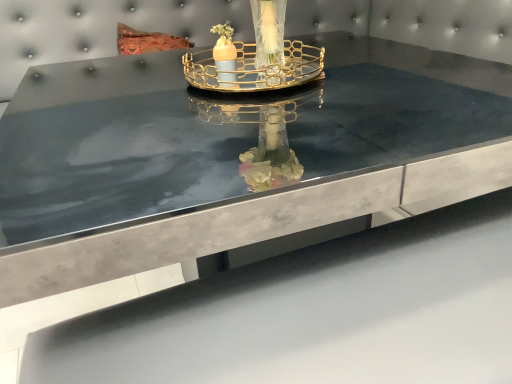
The image size is (512, 384). Find the location of `vacant area that is in front of matte orange candle at center`. vacant area that is in front of matte orange candle at center is located at coordinates (246, 99).